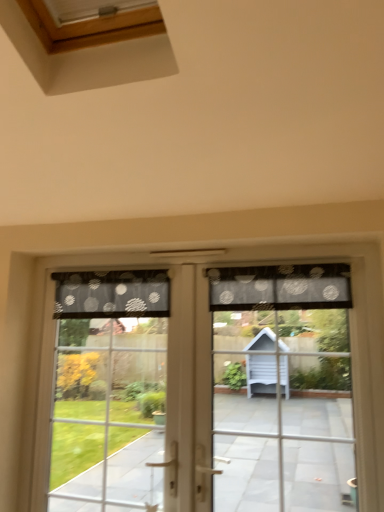
Question: Which is correct: translucent polka dot curtain at center is inside transparent fabric at center, or outside of it?

Choices:
 (A) inside
 (B) outside

Answer: (A)

Question: Based on their positions, is translucent polka dot curtain at center located to the left or right of transparent fabric at center?

Choices:
 (A) right
 (B) left

Answer: (A)

Question: Which object is positioned closest to the black dotted fabric at upper center, the second curtain when ordered from right to left?

Choices:
 (A) black dotted fabric at upper center, the first curtain when ordered from right to left
 (B) translucent fabric curtain at left
 (C) transparent fabric at center
 (D) translucent polka dot curtain at center

Answer: (B)

Question: Which is nearer to the transparent fabric at center?

Choices:
 (A) translucent polka dot curtain at center
 (B) black dotted fabric at upper center, which is the 2th curtain in left-to-right order
 (C) translucent fabric curtain at left
 (D) black dotted fabric at upper center, acting as the first curtain starting from the left

Answer: (A)